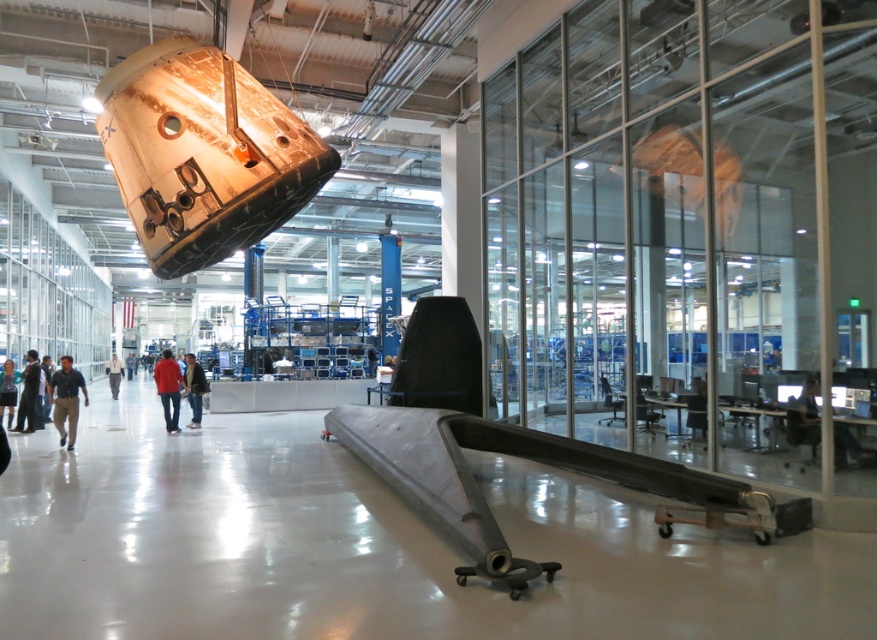
Question: Which point is farther to the camera?

Choices:
 (A) blue denim jacket at lower left
 (B) matte black jacket at center
 (C) dark blue jeans at lower left

Answer: (B)

Question: Is matte black jacket at center positioned before dark blue shirt at center?

Choices:
 (A) no
 (B) yes

Answer: (B)

Question: Which point is farther to the camera?

Choices:
 (A) (8, 378)
 (B) (54, 372)

Answer: (A)

Question: Can you confirm if black glossy computer at lower right is smaller than blue denim jacket at lower left?

Choices:
 (A) no
 (B) yes

Answer: (B)

Question: Can you confirm if black glossy computer at lower right is positioned above red shirt at center?

Choices:
 (A) no
 (B) yes

Answer: (B)

Question: Which point is closer to the camera?

Choices:
 (A) (184, 384)
 (B) (107, 364)
 (C) (66, 372)
 (D) (800, 433)

Answer: (D)